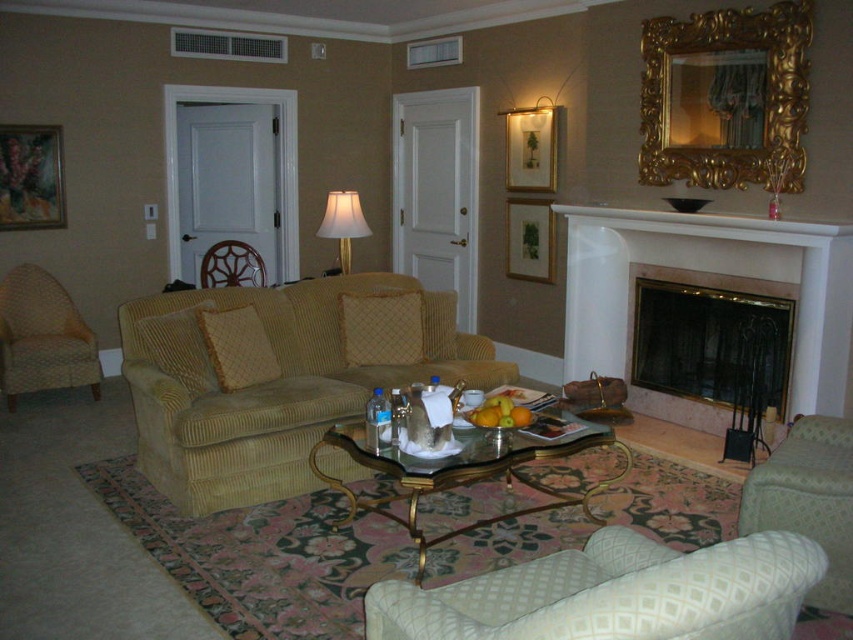
Between black glass fireplace at center and beige corduroy armchair at left, which one is positioned lower?

black glass fireplace at center is lower down.

From the picture: Does black glass fireplace at center have a lesser height compared to beige corduroy armchair at left?

Incorrect, black glass fireplace at center's height does not fall short of beige corduroy armchair at left's.

Does point (630, 371) come farther from viewer compared to point (62, 328)?

No, (630, 371) is in front of (62, 328).

In order to click on black glass fireplace at center in this screenshot , I will do `click(698, 342)`.

Based on the photo, does wooden picture frame at upper left have a greater width compared to white fabric lampshade at center?

No, wooden picture frame at upper left is not wider than white fabric lampshade at center.

Is wooden picture frame at upper left further to camera compared to white fabric lampshade at center?

That is True.

Is point (61, 198) closer to camera compared to point (332, 204)?

No, (61, 198) is further to viewer.

In order to click on wooden picture frame at upper left in this screenshot , I will do `click(30, 177)`.

Is white marble fireplace at center wider than gold-framed picture at center?

Indeed, white marble fireplace at center has a greater width compared to gold-framed picture at center.

Between point (579, 364) and point (550, 236), which one is positioned behind?

Point (550, 236)

At what (x,y) coordinates should I click in order to perform the action: click on white marble fireplace at center. Please return your answer as a coordinate pair (x, y). The width and height of the screenshot is (853, 640). Looking at the image, I should click on (711, 275).